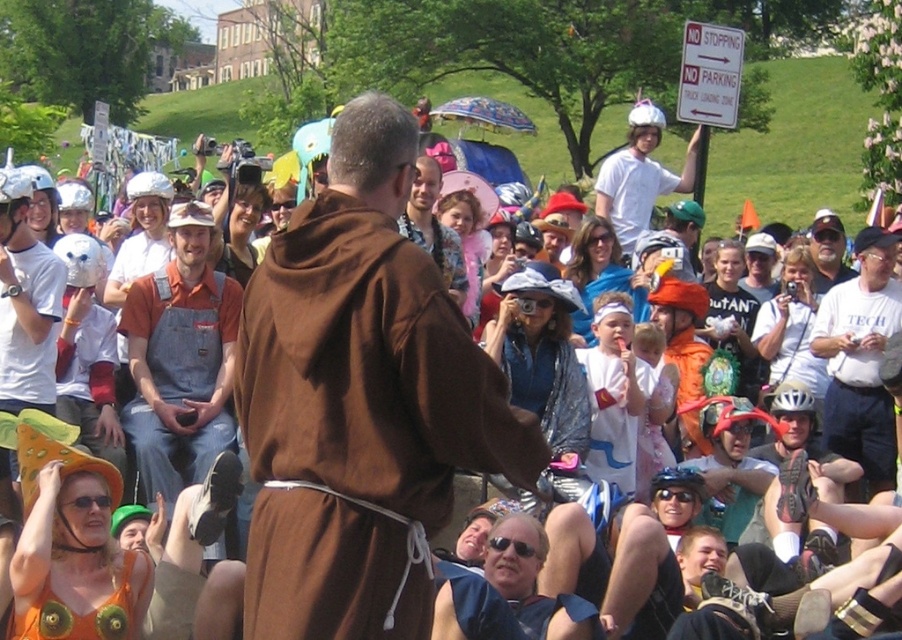
Based on the photo, who is positioned more to the right, brown cloth at center or white cotton shirt at center?

Positioned to the right is white cotton shirt at center.

From the picture: Is brown cloth at center further to the viewer compared to white cotton shirt at center?

No, it is in front of white cotton shirt at center.

This screenshot has height=640, width=902. Identify the location of brown cloth at center. (360, 403).

Image resolution: width=902 pixels, height=640 pixels. I want to click on brown cloth at center, so click(360, 403).

Is point (890, 333) positioned after point (613, 193)?

No, (890, 333) is closer to viewer.

Does white cotton shirt at center have a greater width compared to white matte helmet at upper center?

In fact, white cotton shirt at center might be narrower than white matte helmet at upper center.

Describe the element at coordinates (861, 358) in the screenshot. I see `white cotton shirt at center` at that location.

The image size is (902, 640). Find the location of `white cotton shirt at center`. white cotton shirt at center is located at coordinates (861, 358).

Does brown cloth at center appear on the left side of denim overalls at center?

In fact, brown cloth at center is to the right of denim overalls at center.

Is brown cloth at center further to the viewer compared to denim overalls at center?

No, brown cloth at center is in front of denim overalls at center.

Between point (274, 305) and point (169, 220), which one is positioned behind?

The point (169, 220) is behind.

Where is `brown cloth at center`? This screenshot has height=640, width=902. brown cloth at center is located at coordinates (360, 403).